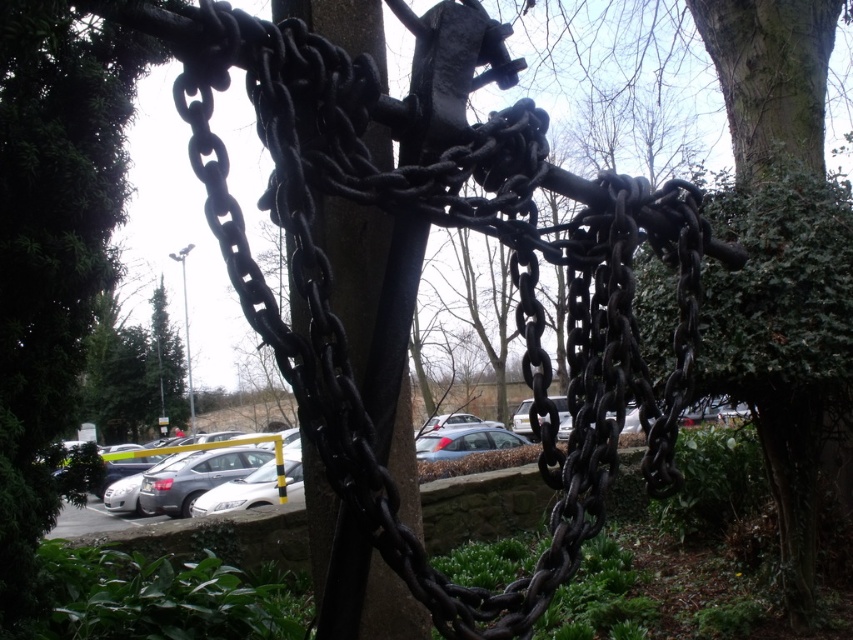
Who is more distant from viewer, (387, 230) or (697, 436)?

Point (697, 436)

Which is in front, point (339, 561) or point (514, 406)?

Point (339, 561) is in front.

Identify the location of black metal pole at center. (376, 321).